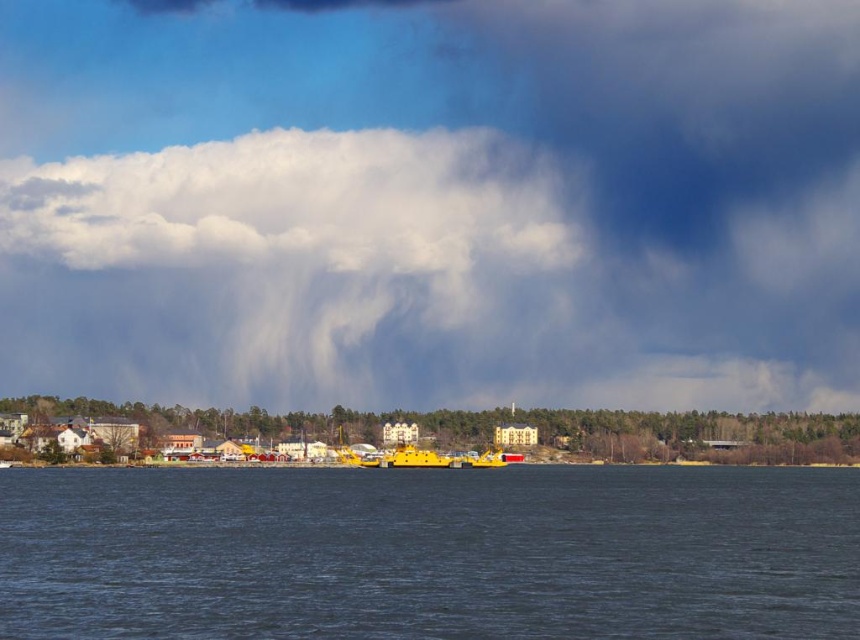
You are an artist planning to paint the lakeside scene. You want to ensure the cloudy sky at upper center and the dark blue water at center are proportionally accurate. Which object should you make larger in your painting?

The cloudy sky at upper center should be made larger in the painting because it is bigger than the dark blue water at center according to the description.

You are a bird soaring above the lakeside scene. You want to fly from the cloudy sky at upper center down to the dark blue water at center. How far will you have to fly vertically to reach the water?

The cloudy sky at upper center is 216.94 meters away from the dark blue water at center, so you will have to fly vertically 216.94 meters to reach the water.